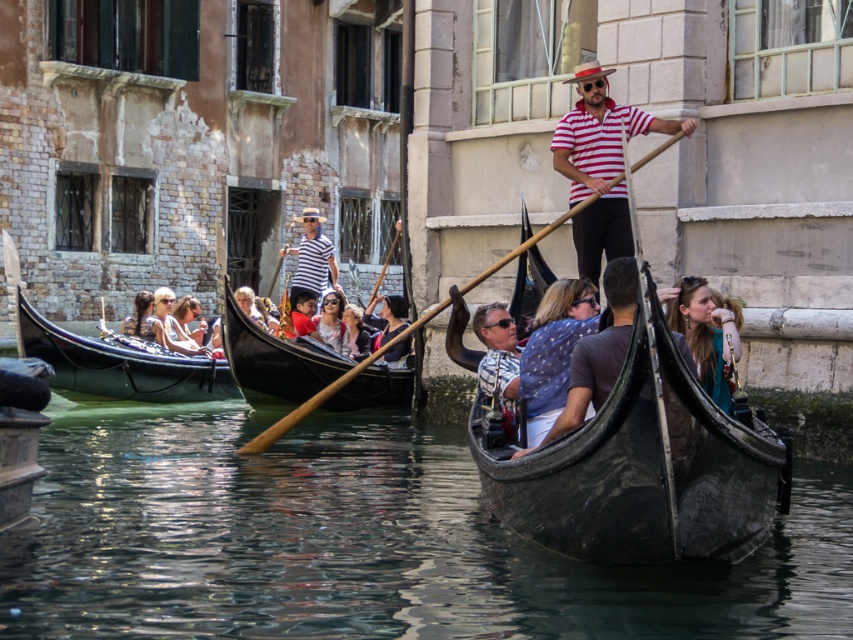
Which is in front, point (372, 300) or point (134, 305)?

Point (372, 300) is more forward.

Is point (401, 348) in front of point (126, 321)?

Yes, it is in front of point (126, 321).

Measure the distance between point (374, 298) and camera.

A distance of 55.35 meters exists between point (374, 298) and camera.

The width and height of the screenshot is (853, 640). I want to click on matte black hair at center, so point(389,314).

From the picture: Who is shorter, black polished gondola at left or matte black hair at center?

matte black hair at center

Which is above, black polished gondola at left or matte black hair at center?

matte black hair at center

What do you see at coordinates (120, 364) in the screenshot? Image resolution: width=853 pixels, height=640 pixels. I see `black polished gondola at left` at bounding box center [120, 364].

Locate an element on the screen. This screenshot has height=640, width=853. black polished gondola at left is located at coordinates (120, 364).

Consider the image. Is matte blue dress at center positioned in front of matte pink sunglasses at center?

Yes.

Does matte blue dress at center appear over matte pink sunglasses at center?

No, matte blue dress at center is not above matte pink sunglasses at center.

This screenshot has width=853, height=640. Describe the element at coordinates (705, 336) in the screenshot. I see `matte blue dress at center` at that location.

Image resolution: width=853 pixels, height=640 pixels. Identify the location of matte blue dress at center. (705, 336).